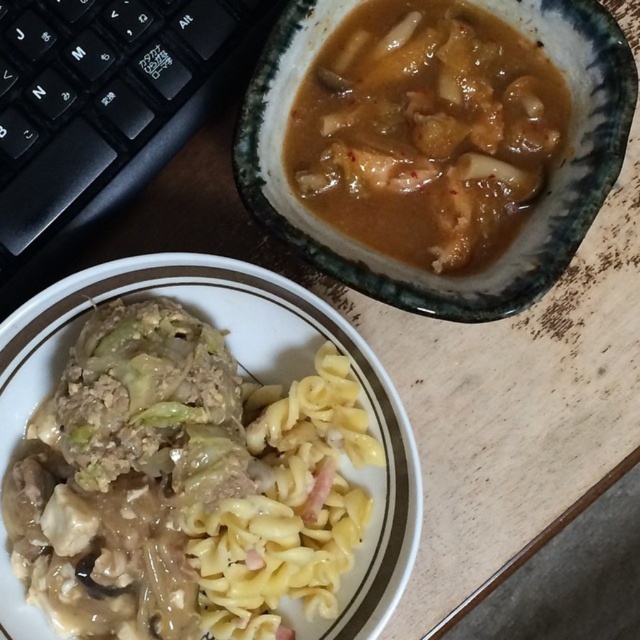
Does yellowish matte pasta at lower left lie in front of yellow matte pasta at center?

Yes, yellowish matte pasta at lower left is in front of yellow matte pasta at center.

Is yellowish matte pasta at lower left to the right of yellow matte pasta at center from the viewer's perspective?

Incorrect, yellowish matte pasta at lower left is not on the right side of yellow matte pasta at center.

Does point (109, 392) lie behind point (209, 550)?

No, it is not.

You are a GUI agent. You are given a task and a screenshot of the screen. Output one action in this format:
    pyautogui.click(x=<x>, y=<y>)
    Task: Click on the yellowish matte pasta at lower left
    This screenshot has height=640, width=640.
    Given the screenshot: What is the action you would take?
    pyautogui.click(x=182, y=484)

Who is taller, yellowish matte pasta at lower left or brown matte stew at upper center?

yellowish matte pasta at lower left

Does point (224, 636) come farther from viewer compared to point (396, 212)?

No.

This screenshot has width=640, height=640. What are the coordinates of `yellowish matte pasta at lower left` in the screenshot? It's located at (182, 484).

Can you confirm if brown matte stew at upper center is shorter than yellow matte pasta at center?

No.

How far apart are brown matte stew at upper center and yellow matte pasta at center?

They are 10.38 inches apart.

Find the location of `brown matte stew at upper center`. brown matte stew at upper center is located at coordinates (426, 131).

The image size is (640, 640). What are the coordinates of `brown matte stew at upper center` in the screenshot? It's located at (426, 131).